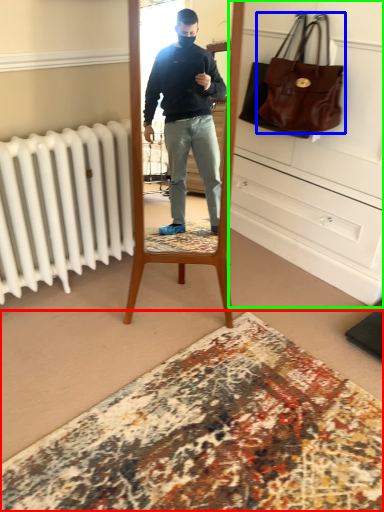
Question: Which object is positioned farthest from plain (highlighted by a red box)? Select from handbag (highlighted by a blue box) and dresser (highlighted by a green box).

Choices:
 (A) handbag
 (B) dresser

Answer: (A)